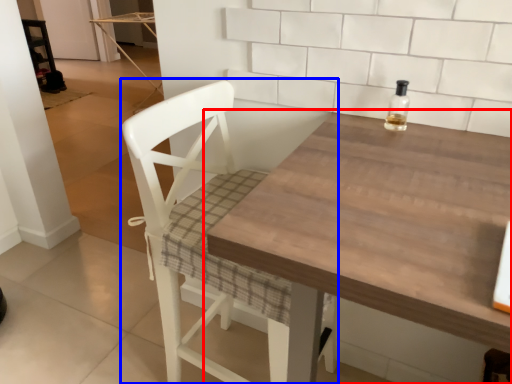
Question: Which object is closer to the camera taking this photo, table (highlighted by a red box) or chair (highlighted by a blue box)?

Choices:
 (A) table
 (B) chair

Answer: (A)